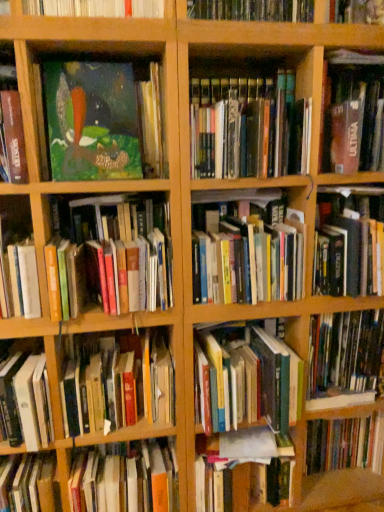
Locate an element on the screen. This screenshot has width=384, height=512. wooden bookshelf at upper left, which appears as the second shelf when viewed from the right is located at coordinates (94, 8).

Describe the element at coordinates (344, 356) in the screenshot. The image size is (384, 512). I see `hardcover book at lower right, marked as the 9th book in a top-to-bottom arrangement` at that location.

Locate an element on the screen. The height and width of the screenshot is (512, 384). hardcover book at lower right, the seventh book when ordered from bottom to top is located at coordinates (344, 356).

This screenshot has height=512, width=384. Find the location of `hardcover book at center right, the 11th book when ordered from bottom to top`. hardcover book at center right, the 11th book when ordered from bottom to top is located at coordinates (349, 241).

What is the approximate height of wooden bookshelf at upper center, placed as the second shelf when sorted from left to right?

6.76 inches.

Describe the element at coordinates (239, 12) in the screenshot. I see `wooden bookshelf at upper center, marked as the 1th shelf in a right-to-left arrangement` at that location.

In order to click on hardcover book at upper right, which is counted as the fifteenth book, starting from the bottom in this screenshot , I will do `click(352, 113)`.

At what (x,y) coordinates should I click in order to perform the action: click on book that is the 2nd one when counting backward from the hardcover book at center right, the 11th book when ordered from bottom to top. Please return your answer as a coordinate pair (x, y). This screenshot has width=384, height=512. Looking at the image, I should click on (119, 385).

From a real-world perspective, which is physically above, hardcover book at center right, the 11th book when ordered from bottom to top, or hardcover book at center, placed as the 5th book when sorted from bottom to top?

hardcover book at center right, the 11th book when ordered from bottom to top, from a real-world perspective.

Consider the image. Considering the sizes of hardcover book at center right, the 11th book when ordered from bottom to top, and hardcover book at center, placed as the 5th book when sorted from bottom to top, in the image, is hardcover book at center right, the 11th book when ordered from bottom to top, wider or thinner than hardcover book at center, placed as the 5th book when sorted from bottom to top,?

hardcover book at center right, the 11th book when ordered from bottom to top, is wider than hardcover book at center, placed as the 5th book when sorted from bottom to top.

Which is nearer, (381, 232) or (91, 357)?

Point (381, 232).

Where is `the 6th book directly above the hardcover books at center, placed as the tenth book when sorted from bottom to top (from a real-world perspective)`? the 6th book directly above the hardcover books at center, placed as the tenth book when sorted from bottom to top (from a real-world perspective) is located at coordinates tap(104, 121).

Is hardcover books at center, placed as the tenth book when sorted from bottom to top, in front of or behind matte green painting at upper left, marked as the fourteenth book in a bottom-to-top arrangement, in the image?

hardcover books at center, placed as the tenth book when sorted from bottom to top, is behind matte green painting at upper left, marked as the fourteenth book in a bottom-to-top arrangement.

Considering the relative positions of hardcover books at center, which is the sixth book from top to bottom, and matte green painting at upper left, marked as the fourteenth book in a bottom-to-top arrangement, in the image provided, is hardcover books at center, which is the sixth book from top to bottom, to the left of matte green painting at upper left, marked as the fourteenth book in a bottom-to-top arrangement, from the viewer's perspective?

In fact, hardcover books at center, which is the sixth book from top to bottom, is to the right of matte green painting at upper left, marked as the fourteenth book in a bottom-to-top arrangement.

From a real-world perspective, is hardcover books at center, placed as the tenth book when sorted from bottom to top, positioned above or below matte green painting at upper left, marked as the fourteenth book in a bottom-to-top arrangement?

In terms of real-world spatial position, hardcover books at center, placed as the tenth book when sorted from bottom to top, is below matte green painting at upper left, marked as the fourteenth book in a bottom-to-top arrangement.

Is hardcover books at center, which is the sixth book from top to bottom, located within wooden bookshelf at upper center, marked as the 1th shelf in a right-to-left arrangement?

That's incorrect, hardcover books at center, which is the sixth book from top to bottom, is not inside wooden bookshelf at upper center, marked as the 1th shelf in a right-to-left arrangement.

Find the location of a particular element. Image resolution: width=384 pixels, height=512 pixels. book that is the 6th one when counting downward from the wooden bookshelf at upper center, placed as the second shelf when sorted from left to right (from the image's perspective) is located at coordinates (246, 249).

From a real-world perspective, does wooden bookshelf at upper center, placed as the second shelf when sorted from left to right, sit lower than hardcover books at center, placed as the tenth book when sorted from bottom to top?

Incorrect, from a real-world perspective, wooden bookshelf at upper center, placed as the second shelf when sorted from left to right, is higher than hardcover books at center, placed as the tenth book when sorted from bottom to top.

Are wooden bookshelf at upper center, marked as the 1th shelf in a right-to-left arrangement, and hardcover books at center, placed as the tenth book when sorted from bottom to top, making contact?

No, wooden bookshelf at upper center, marked as the 1th shelf in a right-to-left arrangement, is not touching hardcover books at center, placed as the tenth book when sorted from bottom to top.

Where is `the 1st book counting from the right side of the hardcover books at center, the sixth book when ordered from bottom to top`? The width and height of the screenshot is (384, 512). the 1st book counting from the right side of the hardcover books at center, the sixth book when ordered from bottom to top is located at coordinates (349, 241).

Which is correct: hardcover books at center, which is the 10th book from top to bottom, is inside hardcover book at center right, marked as the 5th book in a top-to-bottom arrangement, or outside of it?

hardcover books at center, which is the 10th book from top to bottom, exists outside the volume of hardcover book at center right, marked as the 5th book in a top-to-bottom arrangement.

Is hardcover books at center, the sixth book when ordered from bottom to top, touching hardcover book at center right, marked as the 5th book in a top-to-bottom arrangement?

No, hardcover books at center, the sixth book when ordered from bottom to top, is not beside hardcover book at center right, marked as the 5th book in a top-to-bottom arrangement.

Is hardcover books at center, the sixth book when ordered from bottom to top, taller than hardcover book at center right, marked as the 5th book in a top-to-bottom arrangement?

In fact, hardcover books at center, the sixth book when ordered from bottom to top, may be shorter than hardcover book at center right, marked as the 5th book in a top-to-bottom arrangement.

Looking at this image, how many degrees apart are the facing directions of hardcover book at center, the 14th book when ordered from top to bottom, and hardcover books at center, placed as the tenth book when sorted from bottom to top?

hardcover book at center, the 14th book when ordered from top to bottom, and hardcover books at center, placed as the tenth book when sorted from bottom to top, are facing 0.000562 degrees away from each other.

Is hardcover book at center, which is the 2th book in bottom-to-top order, not near hardcover books at center, which is the sixth book from top to bottom?

hardcover book at center, which is the 2th book in bottom-to-top order, is near hardcover books at center, which is the sixth book from top to bottom, not far away.

Looking at this image, does hardcover book at center, which is the 2th book in bottom-to-top order, come behind hardcover books at center, which is the sixth book from top to bottom?

Yes, it is.

From the image's perspective, which book is the 8th one above the hardcover book at center, the 14th book when ordered from top to bottom? Please provide its 2D coordinates.

[(246, 249)]

From the hardcover book at center, which is the fourth book from top to bottom, count 2nd book to the right and point to it. Please provide its 2D coordinates.

[(246, 249)]

From a real-world perspective, who is located lower, hardcover books at center, placed as the tenth book when sorted from bottom to top, or hardcover book at center, which is the fourth book from top to bottom?

From a 3D spatial view, hardcover books at center, placed as the tenth book when sorted from bottom to top, is below.

From the picture: Is hardcover books at center, which is the sixth book from top to bottom, positioned far away from hardcover book at center, which is the fourth book from top to bottom?

hardcover books at center, which is the sixth book from top to bottom, is actually quite close to hardcover book at center, which is the fourth book from top to bottom.

Do you think hardcover book at center, placed as the 5th book when sorted from bottom to top, is within hardcover book at lower right, marked as the 9th book in a top-to-bottom arrangement, or outside of it?

The correct answer is: outside.

Is hardcover book at center, placed as the 5th book when sorted from bottom to top, positioned in front of hardcover book at lower right, the seventh book when ordered from bottom to top?

Yes, hardcover book at center, placed as the 5th book when sorted from bottom to top, is in front of hardcover book at lower right, the seventh book when ordered from bottom to top.

From the image's perspective, which one is positioned higher, hardcover book at center, placed as the 5th book when sorted from bottom to top, or hardcover book at lower right, the seventh book when ordered from bottom to top?

hardcover book at lower right, the seventh book when ordered from bottom to top.

From a real-world perspective, is hardcover book at center, positioned as the eleventh book in top-to-bottom order, under hardcover book at lower right, marked as the 9th book in a top-to-bottom arrangement?

Yes, from a real-world perspective, hardcover book at center, positioned as the eleventh book in top-to-bottom order, is beneath hardcover book at lower right, marked as the 9th book in a top-to-bottom arrangement.

Image resolution: width=384 pixels, height=512 pixels. I want to click on the 4th book located above the hardcover book at center, positioned as the eleventh book in top-to-bottom order (from a real-world perspective), so click(349, 241).

Which book is the 2nd one when counting from the back of the matte green painting at upper left, which is the second book from top to bottom? Please provide its 2D coordinates.

[(246, 249)]

Which object lies nearer to the anchor point hardcover books at center, the sixth book when ordered from bottom to top, hardcover book at lower left, which ranks as the 12th book in top-to-bottom order, or hardcover book at center, which is the 2th book in bottom-to-top order?

Based on the image, hardcover book at center, which is the 2th book in bottom-to-top order, appears to be nearer to hardcover books at center, the sixth book when ordered from bottom to top.

Estimate the real-world distances between objects in this image. Which object is closer to hardcover book at lower left, which ranks as the 12th book in top-to-bottom order, hardcover book at center, which appears as the first book when ordered from the bottom, or hardcover book at left, acting as the eighth book starting from the bottom?

Based on the image, hardcover book at left, acting as the eighth book starting from the bottom, appears to be nearer to hardcover book at lower left, which ranks as the 12th book in top-to-bottom order.

Based on their spatial positions, is hardcover book at center, placed as the 5th book when sorted from bottom to top, or hardcover books at center, the sixth book when ordered from bottom to top, closer to hardcover book at lower right, acting as the 13th book starting from the top?

hardcover books at center, the sixth book when ordered from bottom to top, lies closer to hardcover book at lower right, acting as the 13th book starting from the top, than the other object.

Which object lies nearer to the anchor point hardcover book at center right, marked as the 5th book in a top-to-bottom arrangement, matte green painting at upper left, which is the second book from top to bottom, or hardcover book at center, which appears as the first book when ordered from the bottom?

matte green painting at upper left, which is the second book from top to bottom, lies closer to hardcover book at center right, marked as the 5th book in a top-to-bottom arrangement, than the other object.

Looking at this image, looking at the image, which one is located further to hardcover book at center, the 14th book when ordered from top to bottom, hardcover books at center left, the seventh book from the top, or hardcover book at left, acting as the eighth book starting from the top?

Based on the image, hardcover books at center left, the seventh book from the top, appears to be further to hardcover book at center, the 14th book when ordered from top to bottom.

Based on their spatial positions, is matte green painting at upper left, marked as the fourteenth book in a bottom-to-top arrangement, or hardcover book at center, which is the fourth book from top to bottom, further from hardcover books at center left, the 9th book ordered from the bottom?

hardcover book at center, which is the fourth book from top to bottom.

Considering their positions, is hardcover books at center, which is the 10th book from top to bottom, positioned closer to matte green painting at upper left, which is the second book from top to bottom, than hardcover book at lower right, marked as the 9th book in a top-to-bottom arrangement?

hardcover books at center, which is the 10th book from top to bottom, is positioned closer to the anchor matte green painting at upper left, which is the second book from top to bottom.

Looking at this image, estimate the real-world distances between objects in this image. Which object is closer to matte green painting at upper left, the 3th book when ordered from top to bottom, hardcover book at lower right, the third book from the bottom, or hardcover book at upper right, which is counted as the fifteenth book, starting from the bottom?

hardcover book at upper right, which is counted as the fifteenth book, starting from the bottom, is closer to matte green painting at upper left, the 3th book when ordered from top to bottom.

At what (x,y) coordinates should I click in order to perform the action: click on shelf between wooden bookshelf at upper center, placed as the second shelf when sorted from left to right, and hardcover book at left, acting as the eighth book starting from the bottom, from top to bottom. Please return your answer as a coordinate pair (x, y). This screenshot has height=512, width=384. Looking at the image, I should click on (94, 8).

This screenshot has height=512, width=384. I want to click on shelf between wooden bookshelf at upper center, placed as the second shelf when sorted from left to right, and hardcover book at lower right, acting as the 13th book starting from the top, in the vertical direction, so click(x=94, y=8).

The height and width of the screenshot is (512, 384). Identify the location of shelf between wooden bookshelf at upper center, marked as the 1th shelf in a right-to-left arrangement, and hardcover book at center, placed as the 5th book when sorted from bottom to top, from top to bottom. 94,8.

I want to click on shelf between wooden bookshelf at upper left, the first shelf when ordered from left to right, and hardcover book at upper right, which is counted as the fifteenth book, starting from the bottom, in the horizontal direction, so click(239, 12).